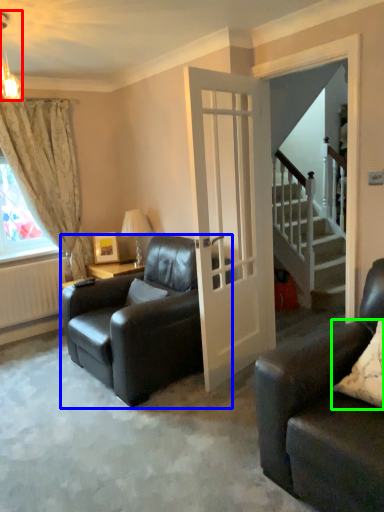
Question: Estimate the real-world distances between objects in this image. Which object is farther from light fixture (highlighted by a red box), chair (highlighted by a blue box) or pillow (highlighted by a green box)?

Choices:
 (A) chair
 (B) pillow

Answer: (B)